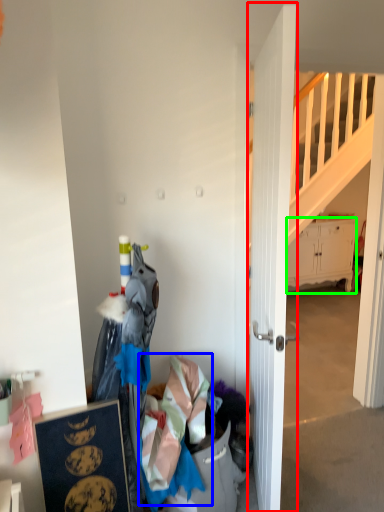
Question: Which object is positioned farthest from door (highlighted by a red box)? Select from clothing (highlighted by a blue box) and cabinetry (highlighted by a green box).

Choices:
 (A) clothing
 (B) cabinetry

Answer: (B)